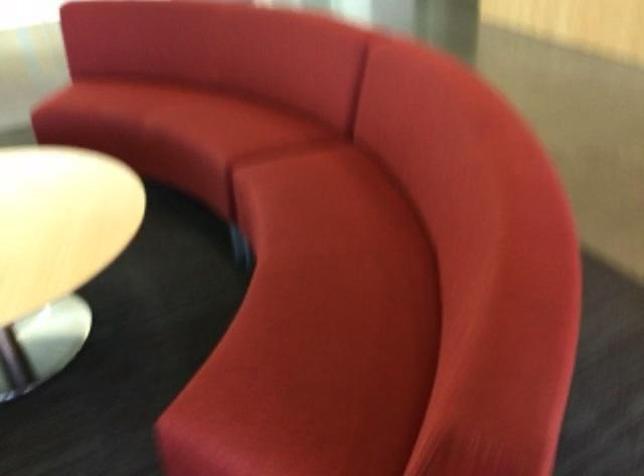
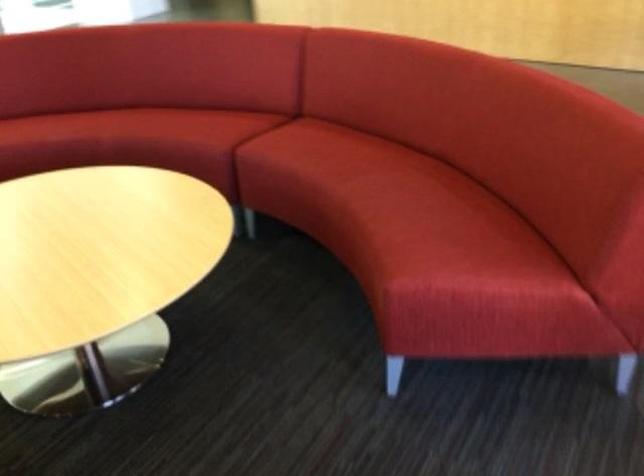
In the second image, find the point that corresponds to point (295, 266) in the first image.

(370, 186)